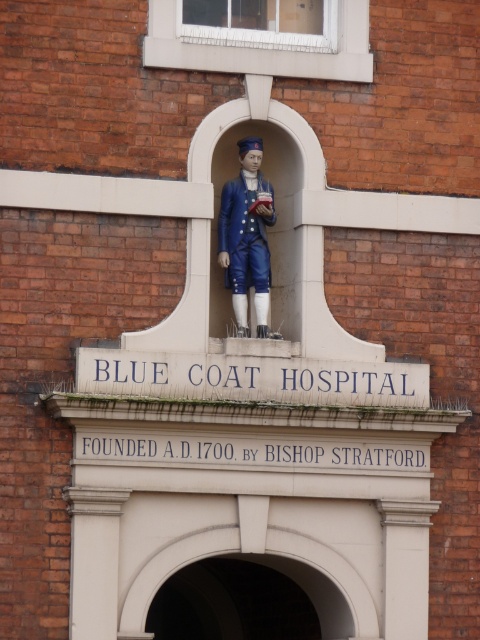
Question: Is white stone arch at center smaller than matte blue uniform at center?

Choices:
 (A) yes
 (B) no

Answer: (B)

Question: Is white stone arch at center below matte blue uniform at center?

Choices:
 (A) no
 (B) yes

Answer: (B)

Question: Considering the relative positions of white stone arch at center and matte blue uniform at center in the image provided, where is white stone arch at center located with respect to matte blue uniform at center?

Choices:
 (A) above
 (B) below

Answer: (B)

Question: Which point is farther to the camera?

Choices:
 (A) (322, 630)
 (B) (249, 189)

Answer: (A)

Question: Which of the following is the closest to the observer?

Choices:
 (A) (311, 572)
 (B) (243, 157)

Answer: (A)